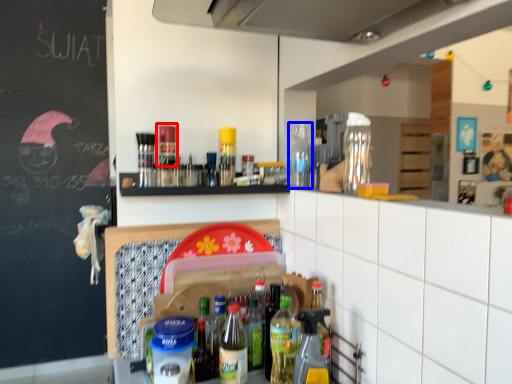
Question: Which point is closer to the camera, bottle (highlighted by a red box) or bottle (highlighted by a blue box)?

Choices:
 (A) bottle
 (B) bottle

Answer: (A)